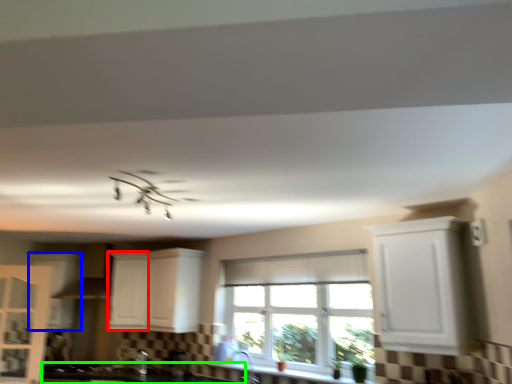
Question: Estimate the real-world distances between objects in this image. Which object is farther from cabinetry (highlighted by a red box), cabinetry (highlighted by a blue box) or countertop (highlighted by a green box)?

Choices:
 (A) cabinetry
 (B) countertop

Answer: (B)